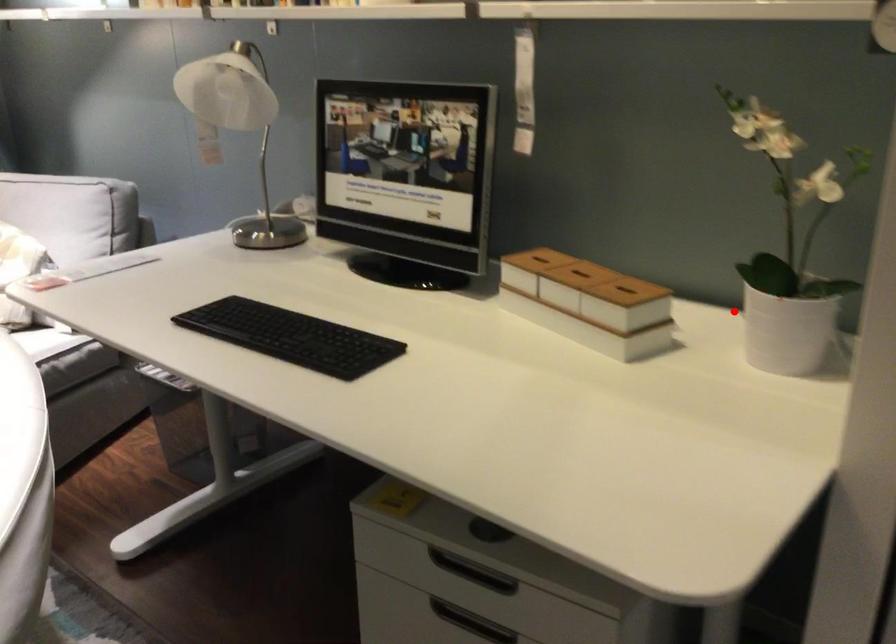
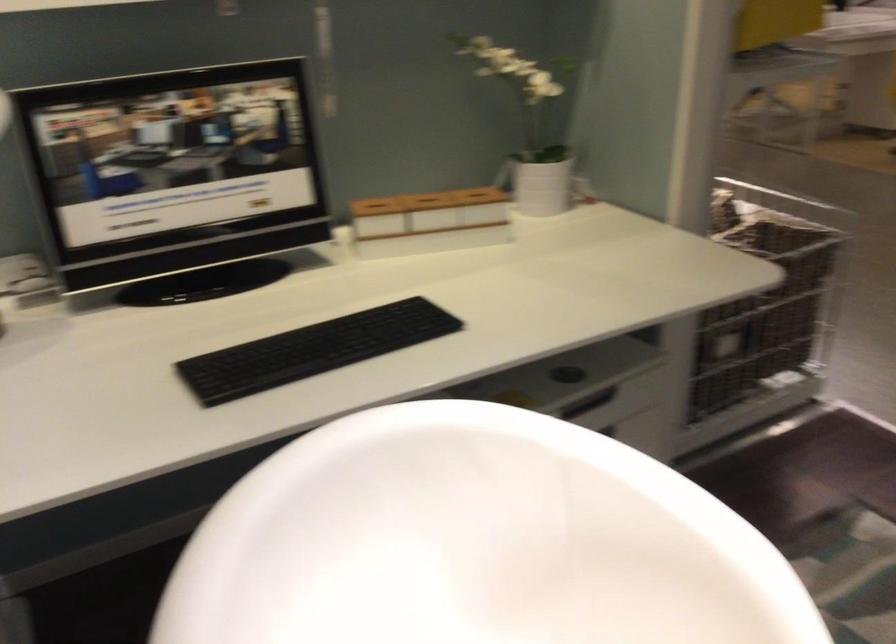
Locate, in the second image, the point that corresponds to the highlighted location in the first image.

(543, 182)